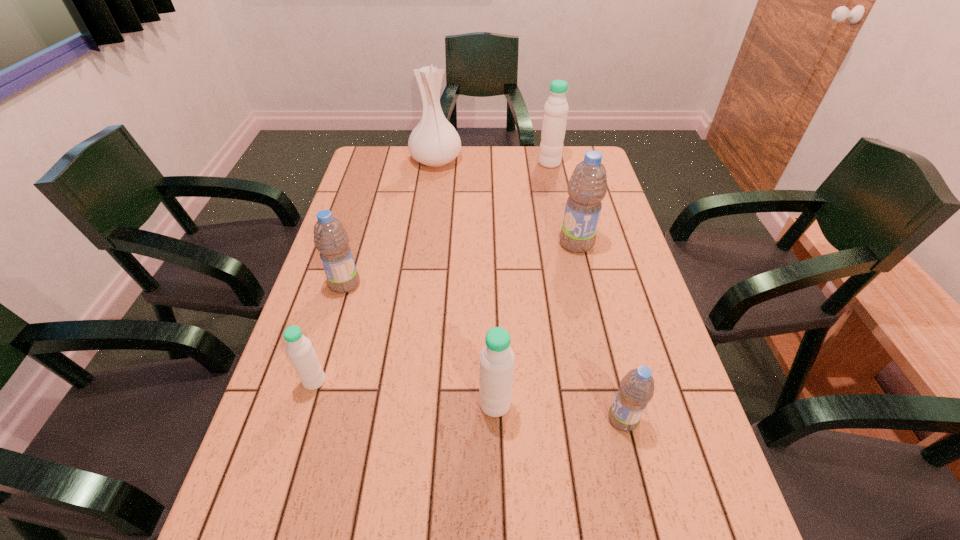
Find the location of a particular element. empty space between the fifth nearest water bottle and the second white water bottle from left to right is located at coordinates (536, 324).

Where is `empty space that is in between the white vase and the second white water bottle from left to right`? This screenshot has height=540, width=960. empty space that is in between the white vase and the second white water bottle from left to right is located at coordinates (466, 282).

Where is `empty space that is in between the smallest white water bottle and the third farthest object`? This screenshot has height=540, width=960. empty space that is in between the smallest white water bottle and the third farthest object is located at coordinates (445, 312).

Locate an element on the screen. vacant space in between the nearest blue water bottle and the second biggest white water bottle is located at coordinates (559, 411).

Locate which object ranks second in proximity to the farthest water bottle. Please provide its 2D coordinates. Your answer should be formatted as a tuple, i.e. [(x, y)], where the tuple contains the x and y coordinates of a point satisfying the conditions above.

[(587, 187)]

Point out which object is positioned as the third nearest to the farthest water bottle. Please provide its 2D coordinates. Your answer should be formatted as a tuple, i.e. [(x, y)], where the tuple contains the x and y coordinates of a point satisfying the conditions above.

[(330, 237)]

Locate which water bottle is the closest to the farthest white water bottle. Please provide its 2D coordinates. Your answer should be formatted as a tuple, i.e. [(x, y)], where the tuple contains the x and y coordinates of a point satisfying the conditions above.

[(587, 187)]

Where is `water bottle that stands as the closest to the leftmost white water bottle`? water bottle that stands as the closest to the leftmost white water bottle is located at coordinates (330, 237).

Where is `white water bottle that is the closest to the farthest blue water bottle`? This screenshot has width=960, height=540. white water bottle that is the closest to the farthest blue water bottle is located at coordinates (554, 122).

The width and height of the screenshot is (960, 540). In order to click on white water bottle that is the closest one to the fourth water bottle from right to left in this screenshot , I will do `click(299, 348)`.